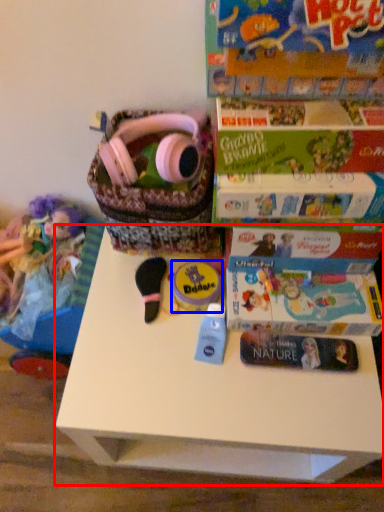
Question: Which of the following is the farthest to the observer, table (highlighted by a red box) or toy (highlighted by a blue box)?

Choices:
 (A) table
 (B) toy

Answer: (B)